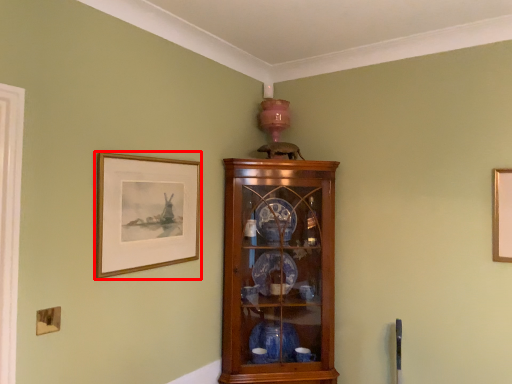
Question: Where is picture frame (annotated by the red box) located in relation to cupboard in the image?

Choices:
 (A) left
 (B) right

Answer: (A)